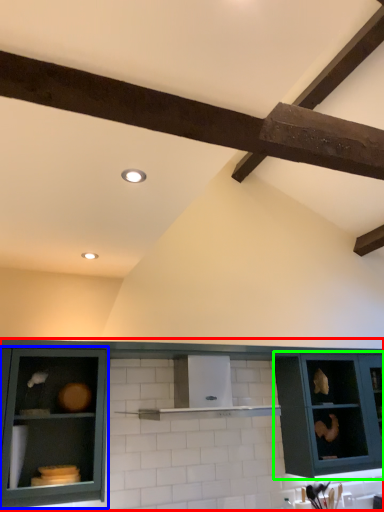
Question: Estimate the real-world distances between objects in this image. Which object is farther from cabinetry (highlighted by a red box), cabinetry (highlighted by a blue box) or cabinetry (highlighted by a green box)?

Choices:
 (A) cabinetry
 (B) cabinetry

Answer: (B)